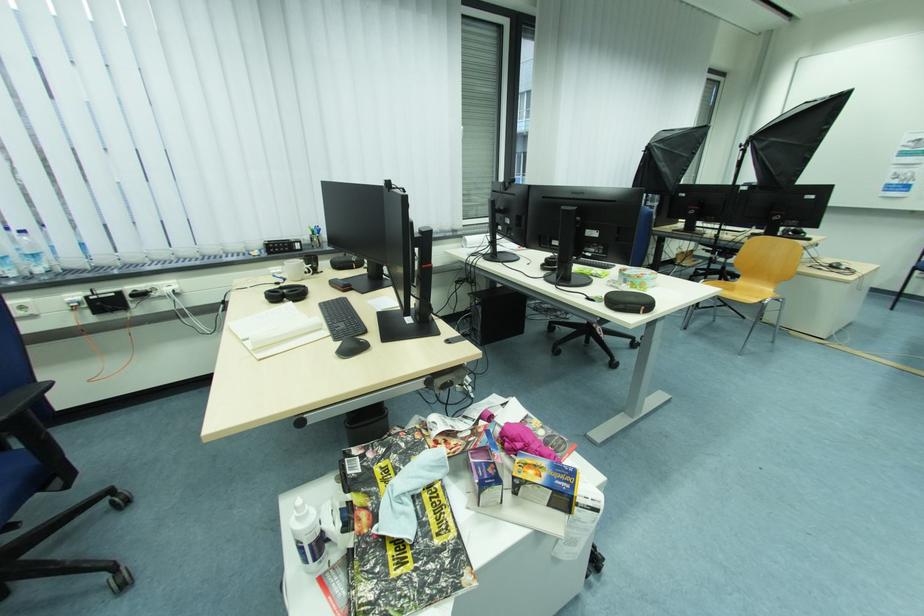
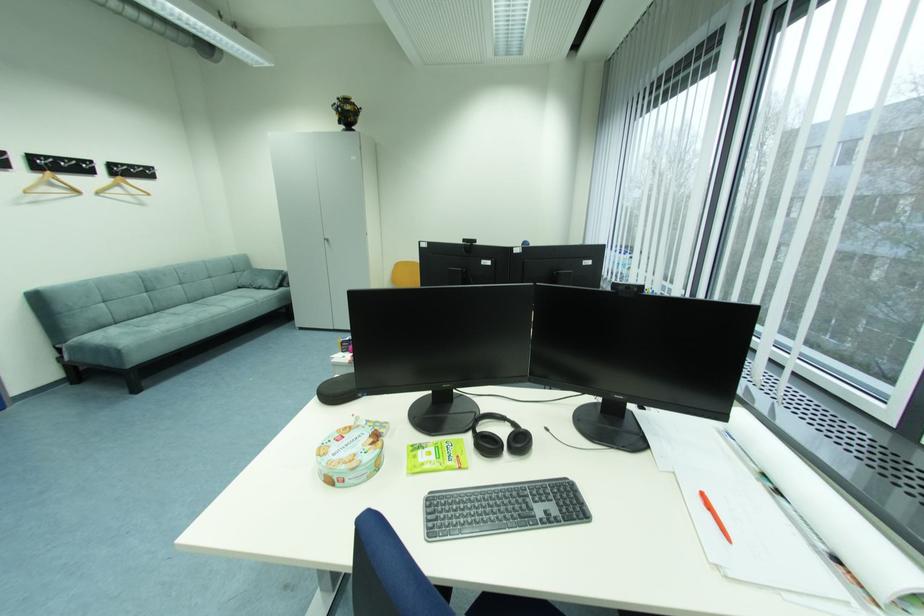
Question: I am providing you with two images of the same scene from different viewpoints. After the viewpoint changes to image2, which objects are now occluded?

Choices:
 (A) white mug handle
 (B) cabinet door handle
 (C) black headphones
 (D) dish soap bottle

Answer: (A)